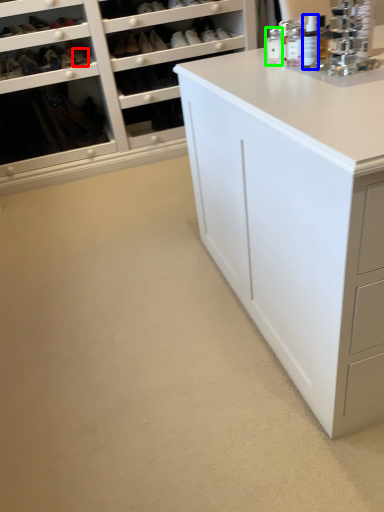
Question: Which object is the farthest from shoe (highlighted by a red box)? Choose among these: toiletry (highlighted by a blue box) or toiletry (highlighted by a green box).

Choices:
 (A) toiletry
 (B) toiletry

Answer: (A)